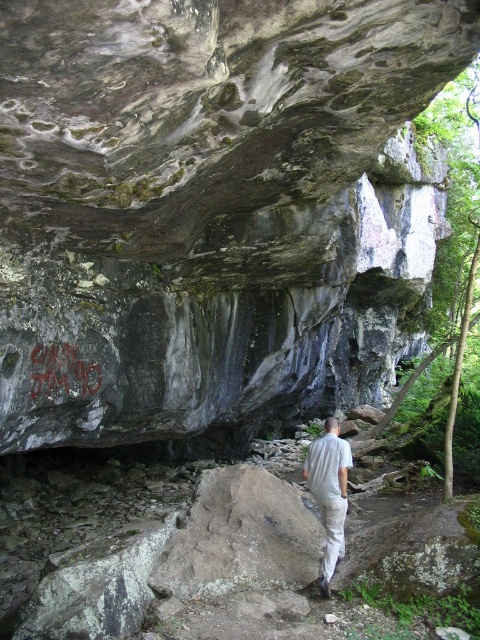
Question: Which of these objects is positioned closest to the light gray cotton shirt at center?

Choices:
 (A) dark gray textured rock at center
 (B) graffiti stone at center

Answer: (B)

Question: Is dark gray textured rock at center thinner than light gray cotton shirt at center?

Choices:
 (A) yes
 (B) no

Answer: (A)

Question: Which point appears closest to the camera in this image?

Choices:
 (A) (48, 378)
 (B) (342, 538)
 (C) (193, 72)

Answer: (C)

Question: Where is light gray cotton shirt at center located in relation to graffiti stone at center in the image?

Choices:
 (A) above
 (B) below

Answer: (B)

Question: Is dark gray textured rock at center bigger than light gray cotton shirt at center?

Choices:
 (A) no
 (B) yes

Answer: (A)

Question: Which is farther from the graffiti stone at center?

Choices:
 (A) dark gray textured rock at center
 (B) light gray cotton shirt at center

Answer: (A)